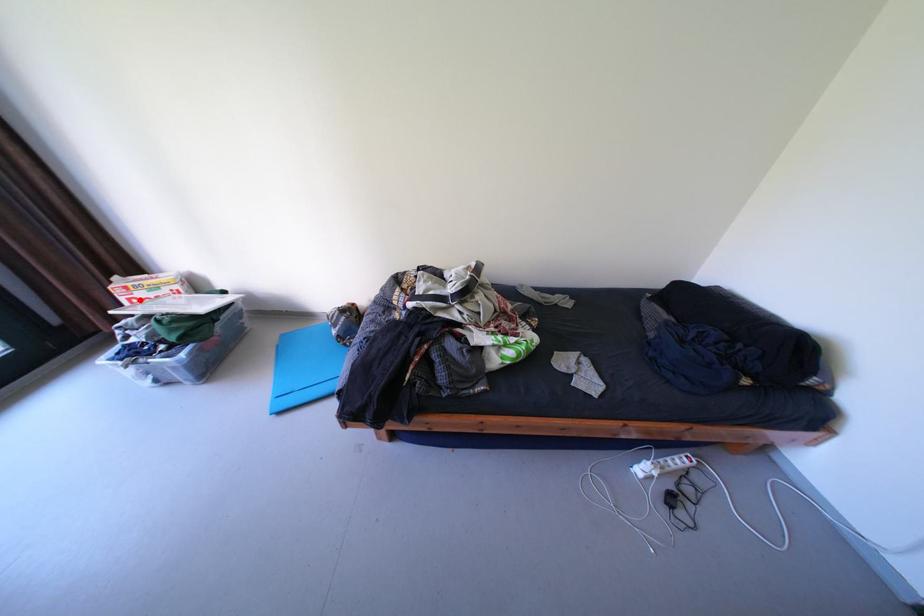
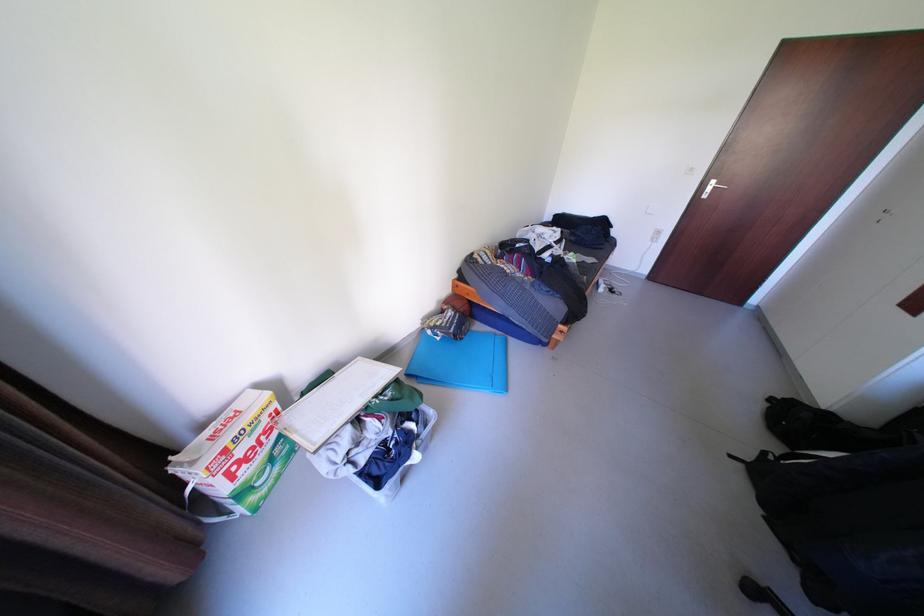
In the second image, find the point that corresponds to the highlighted location in the first image.

(237, 474)